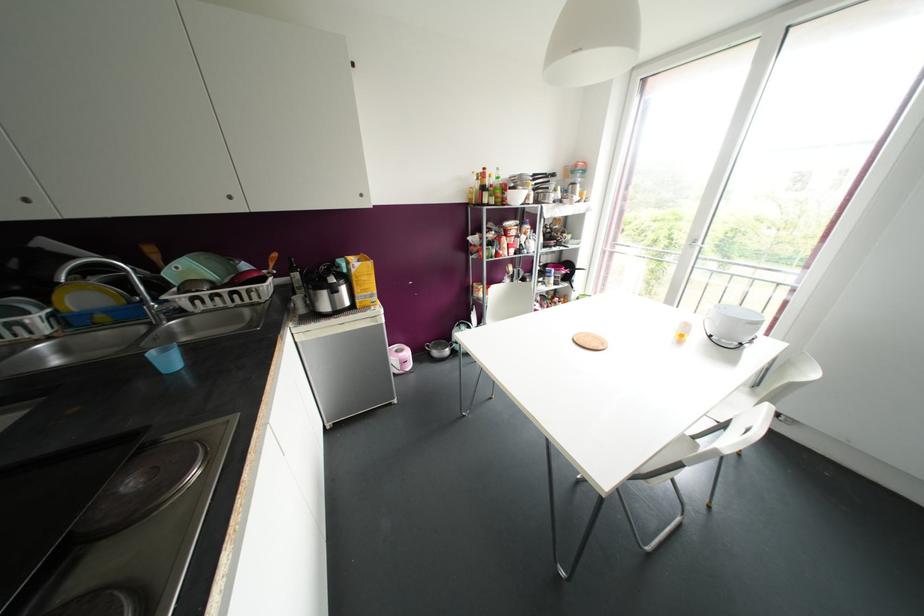
Find where to lift the white ceramic bowl. Please return your answer as a coordinate pair (x, y).

(733, 325)